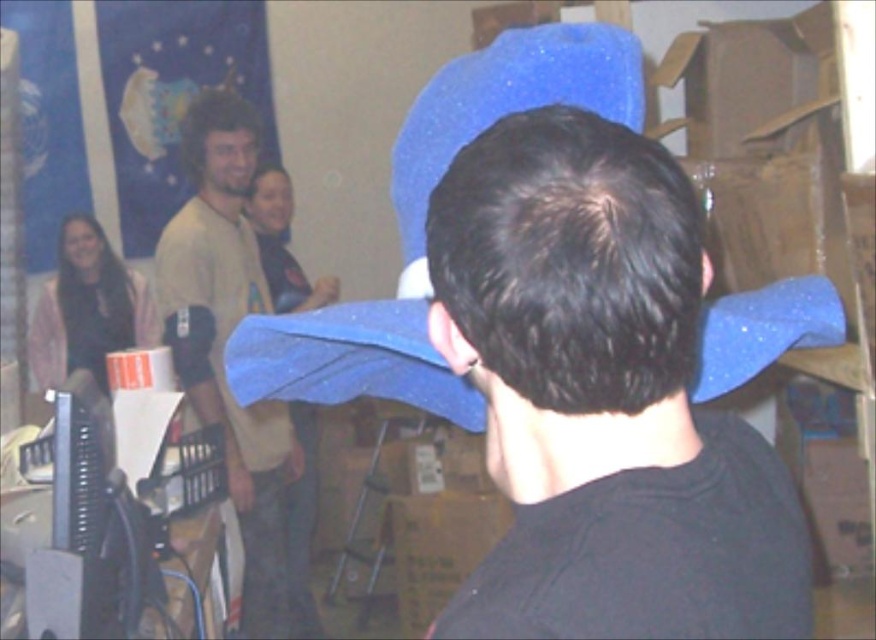
You are organizing a costume party and need to decide which accessory to place on a narrow shelf. The shelf can only accommodate items up to the width of the matte pink sweater at left. Can the blue sparkly hat at center fit on the shelf?

The blue sparkly hat at center has a larger width than the matte pink sweater at left, so it cannot fit on the shelf designed for items up to the width of the matte pink sweater at left.

You are organizing a costume party and need to decide which item to place on a narrow shelf. The shelf can only hold items that are less than 2 inches thick. You have the matte blue hat at center and the matte yellow shirt at upper left. Based on their thickness, which item can fit on the shelf?

The matte blue hat at center is thinner than the matte yellow shirt at upper left, so the matte blue hat at center can fit on the shelf since it is thinner than 2 inches.

You are at an event and want to take a photo of the blue sparkly hat at center and the matte pink sweater at left. Which object should you focus on first to ensure both are in focus?

The blue sparkly hat at center is closer to the viewer than the matte pink sweater at left. To ensure both are in focus, you should focus on the matte pink sweater at left since it is further away, allowing the blue sparkly hat at center to be within the depth of field.